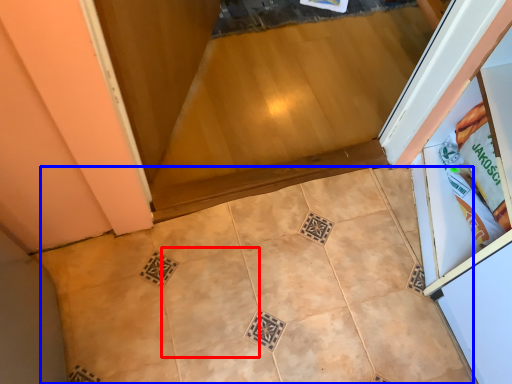
Question: Which of the following is the farthest to the observer, ceramic tile (highlighted by a red box) or ceramic tile (highlighted by a blue box)?

Choices:
 (A) ceramic tile
 (B) ceramic tile

Answer: (A)